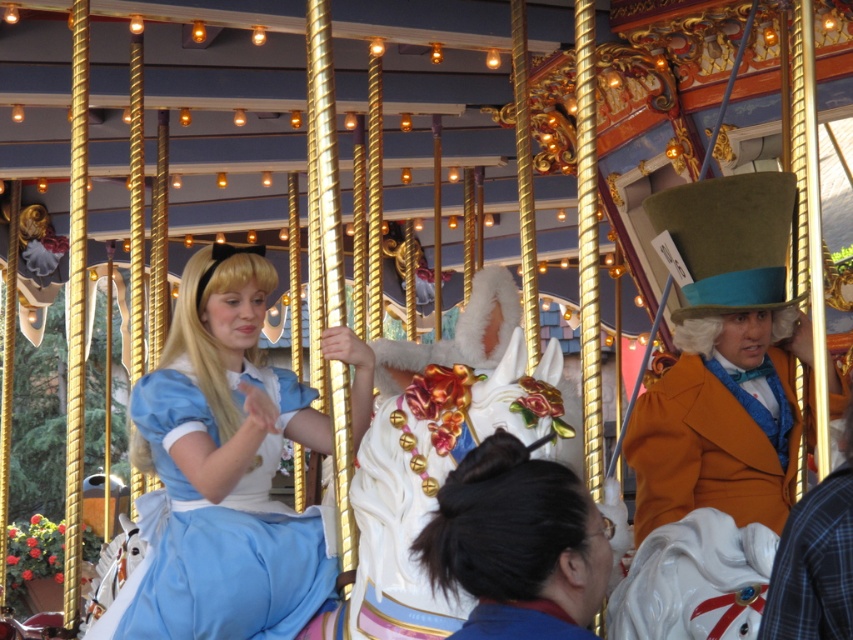
From the picture: You are a photographer standing at the center of the carousel. You want to take a photo of the orange velvet top hat at upper right and the matte blue dress at center. Given that your camera has a maximum focus range of 40 feet, will you be able to capture both objects clearly in the same photo?

The orange velvet top hat at upper right is 46.94 feet away from the matte blue dress at center. Since the camera can only focus up to 40 feet, the distance between them exceeds the maximum focus range. Therefore, you won

You are standing at the center of the carousel and want to walk towards the direction of point (532, 572). Will you pass by point (798, 436) first before reaching your destination?

Point (532, 572) is in front of point (798, 436), so you will reach point (532, 572) before passing point (798, 436). Therefore, you will not pass by point (798, 436) first before reaching your destination.